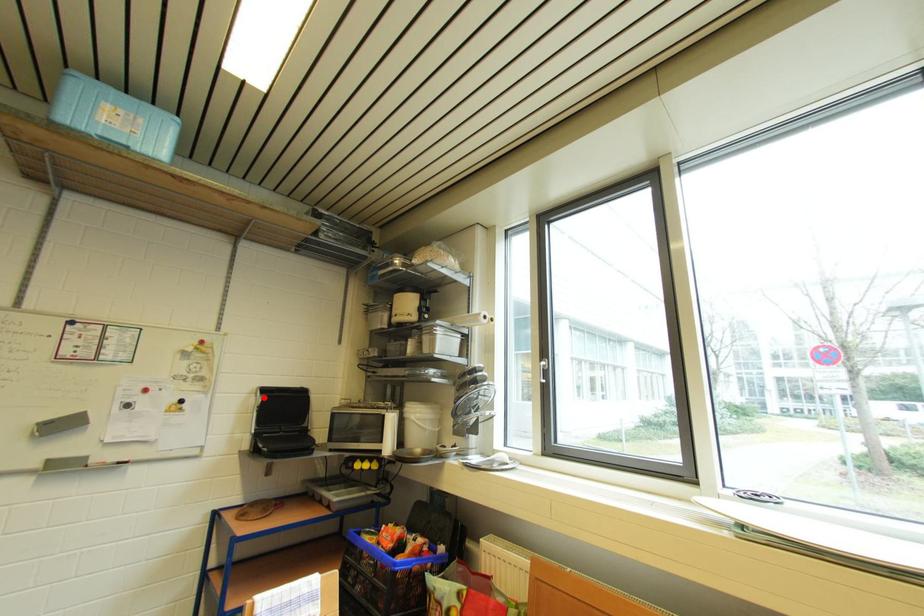
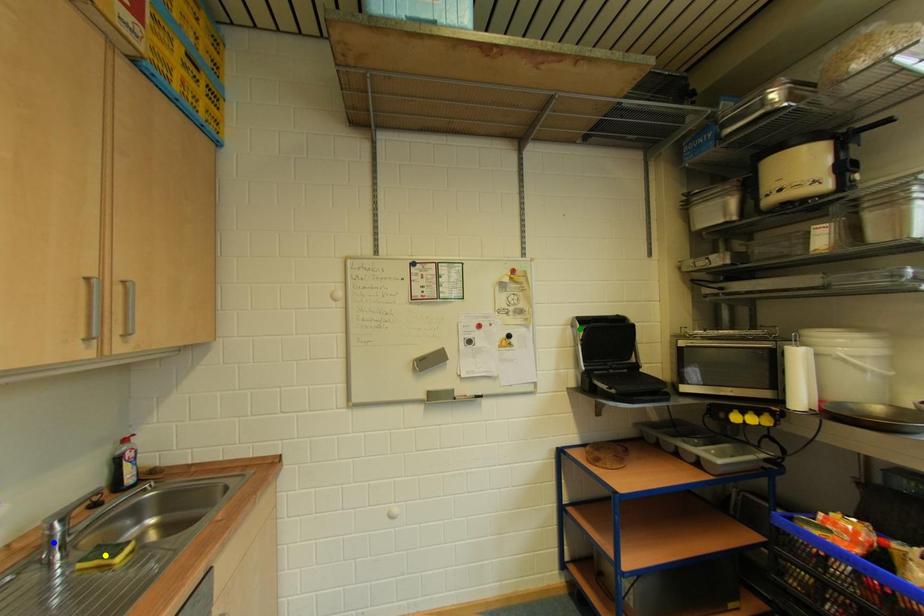
Question: I am providing you with two images of the same scene from different viewpoints. A red point is marked on the first image. You are given multiple points on the second image. Which spot in image 2 lines up with the point in image 1?

Choices:
 (A) green point
 (B) yellow point
 (C) blue point

Answer: (A)